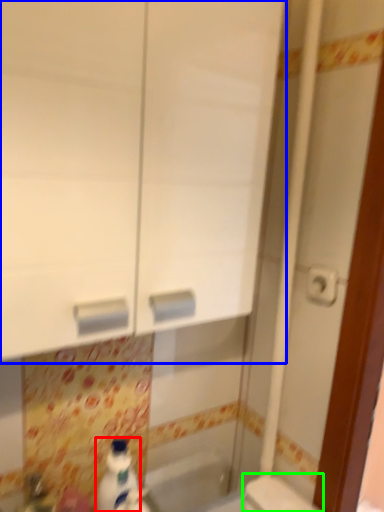
Question: Based on their relative distances, which object is farther from cleaning product (highlighted by a red box)? Choose from medicine cabinet (highlighted by a blue box) and toilet (highlighted by a green box).

Choices:
 (A) medicine cabinet
 (B) toilet

Answer: (A)